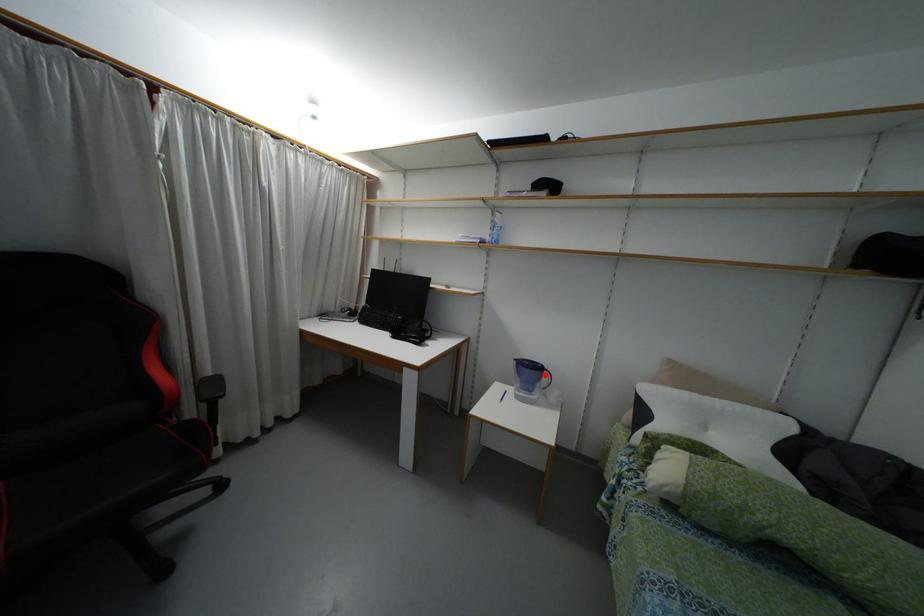
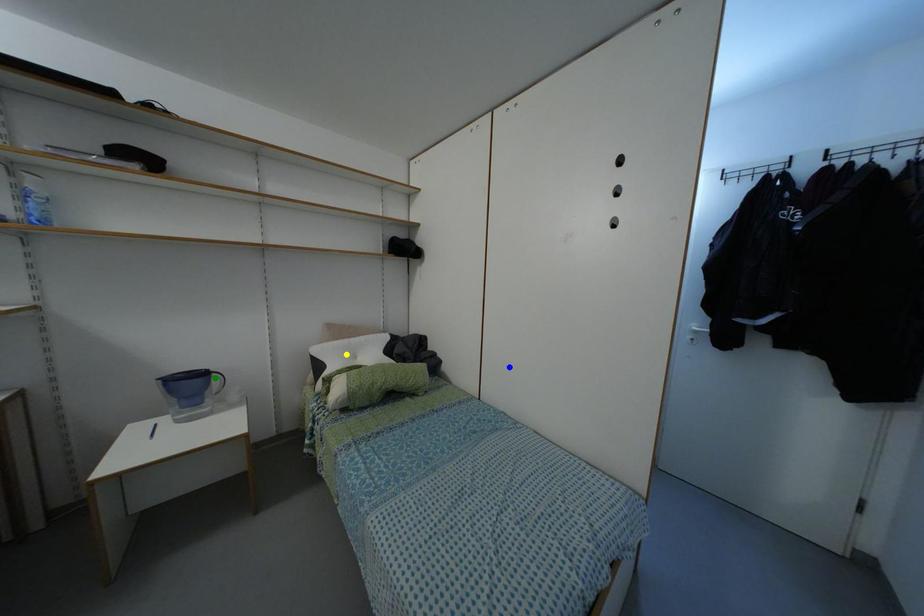
Question: I am providing you with two images of the same scene from different viewpoints. A red point is marked on the first image. You are given multiple points on the second image. In image 2, which mark is for the same physical point as the one in image 1?

Choices:
 (A) green point
 (B) blue point
 (C) yellow point

Answer: (A)